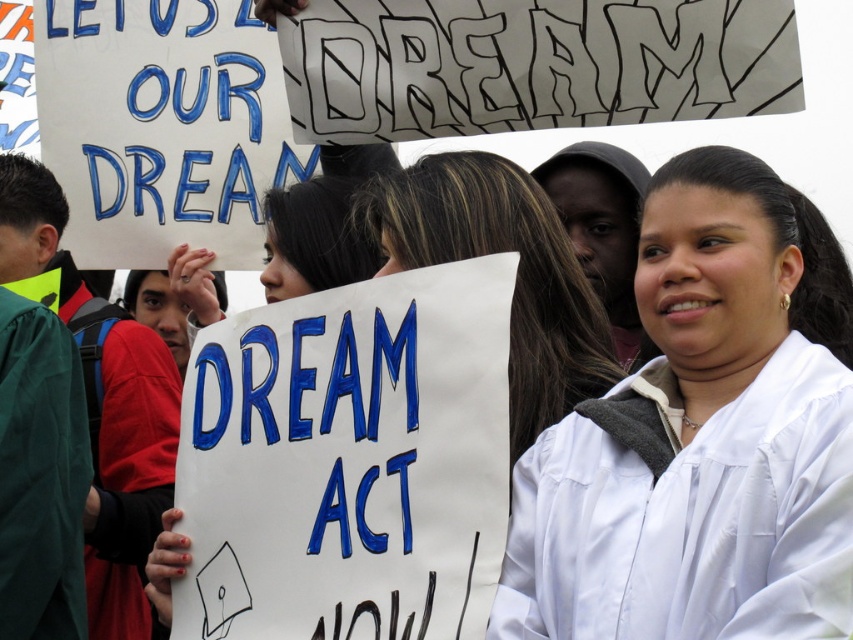
Is white satin graduation gown at center above white matte graduation gown at center?

Incorrect, white satin graduation gown at center is not positioned above white matte graduation gown at center.

Does point (767, 253) lie behind point (560, 369)?

No, (767, 253) is in front of (560, 369).

What do you see at coordinates (703, 435) in the screenshot? I see `white satin graduation gown at center` at bounding box center [703, 435].

The image size is (853, 640). What are the coordinates of `white satin graduation gown at center` in the screenshot? It's located at (703, 435).